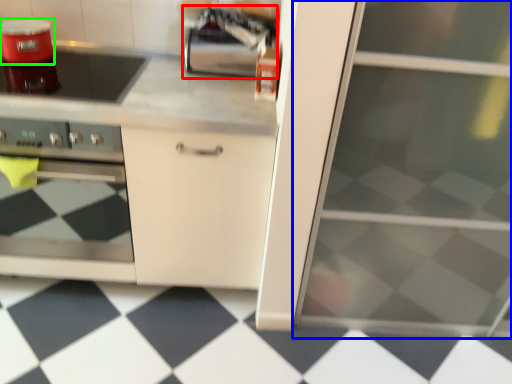
Question: Which is nearer to the appliance (highlighted by a red box)? screen door (highlighted by a blue box) or kitchen appliance (highlighted by a green box).

Choices:
 (A) screen door
 (B) kitchen appliance

Answer: (B)